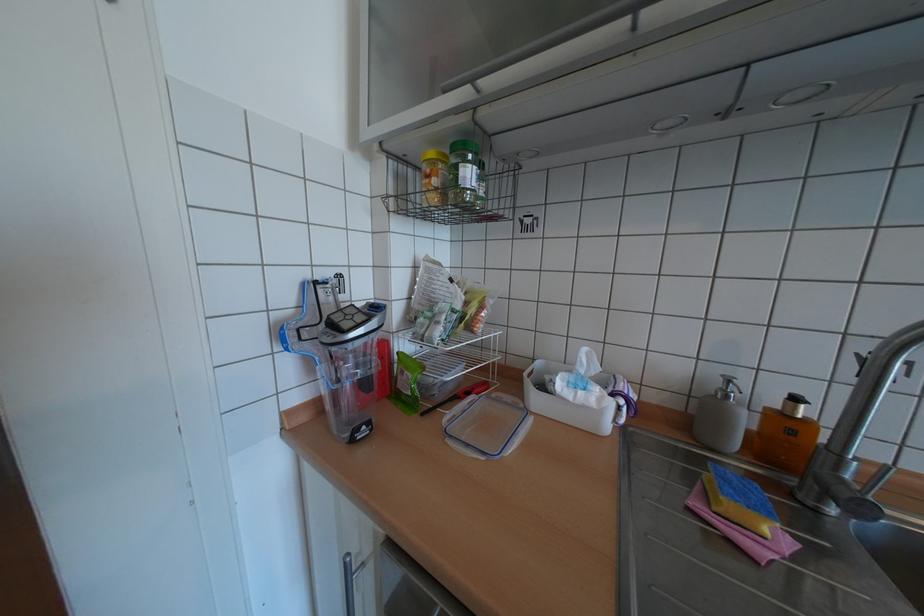
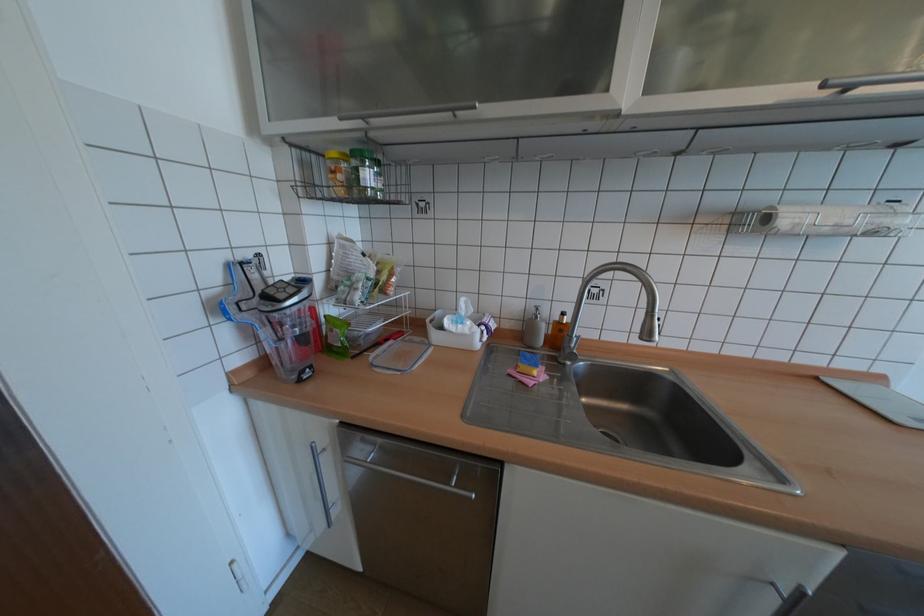
In the second image, find the point that corresponds to (590,392) in the first image.

(468, 326)